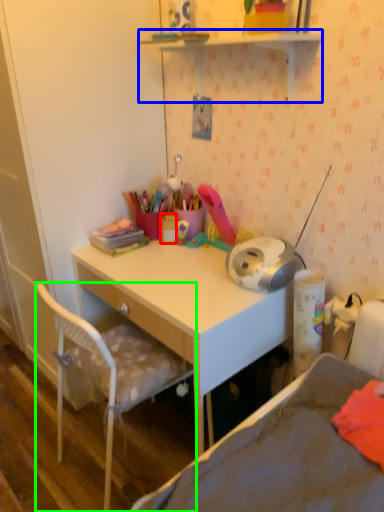
Question: Which is nearer to the stationery (highlighted by a red box)? shelf (highlighted by a blue box) or chair (highlighted by a green box).

Choices:
 (A) shelf
 (B) chair

Answer: (B)